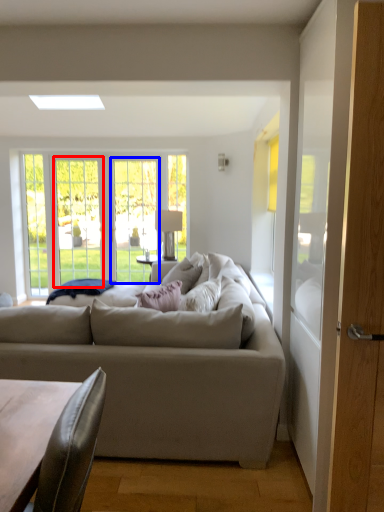
Question: Among these objects, which one is nearest to the camera, glass door (highlighted by a red box) or screen door (highlighted by a blue box)?

Choices:
 (A) glass door
 (B) screen door

Answer: (B)